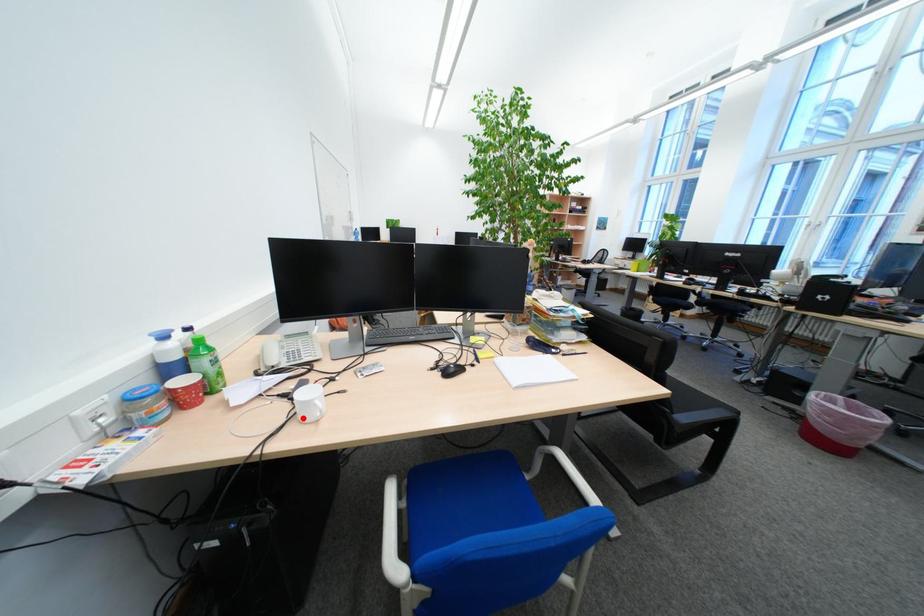
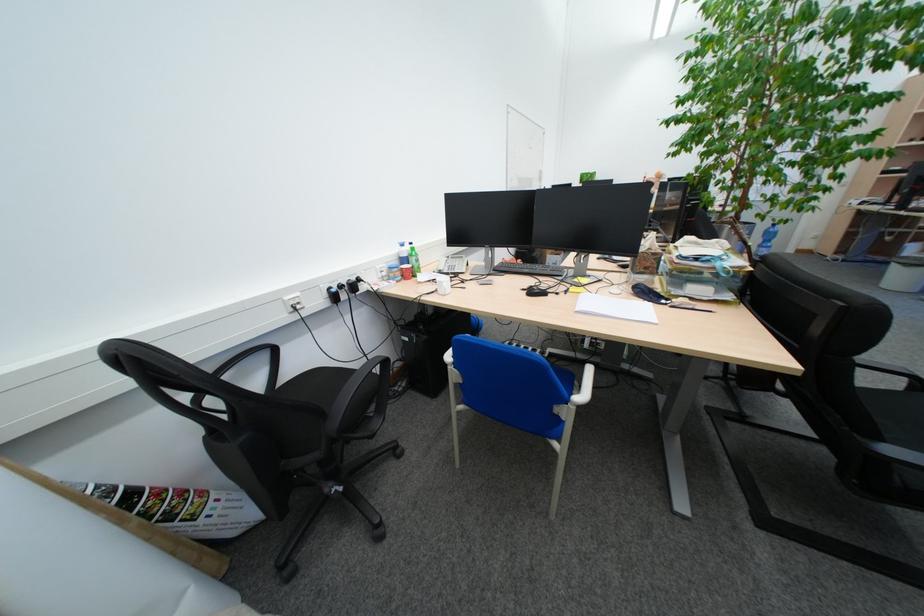
Locate, in the second image, the point that corresponds to the highlighted location in the first image.

(447, 292)